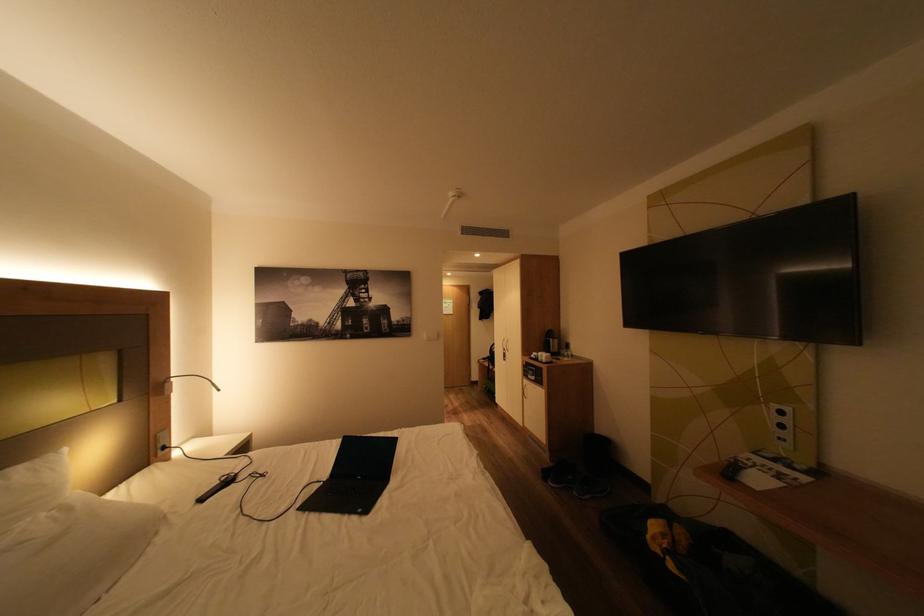
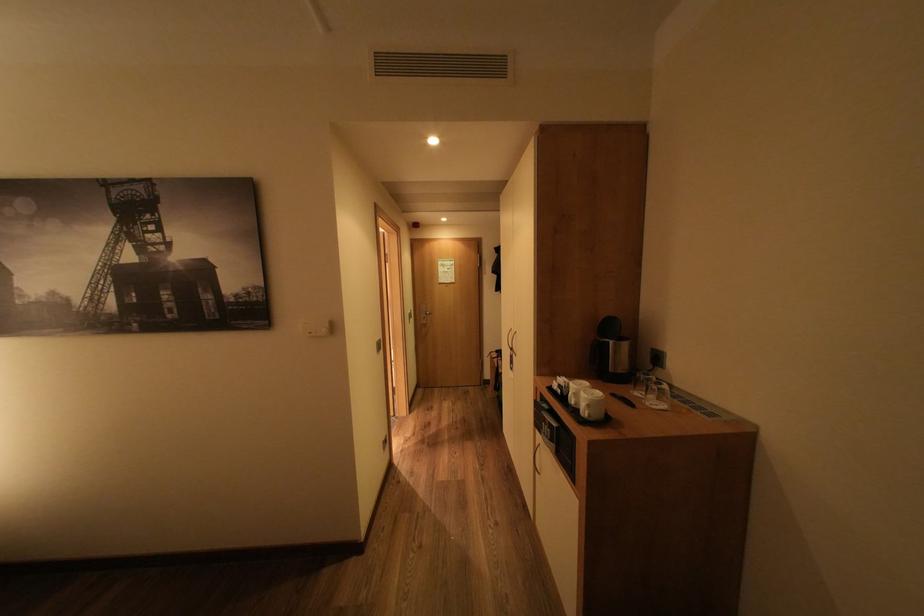
The point at (502, 368) is marked in the first image. Where is the corresponding point in the second image?

(511, 371)